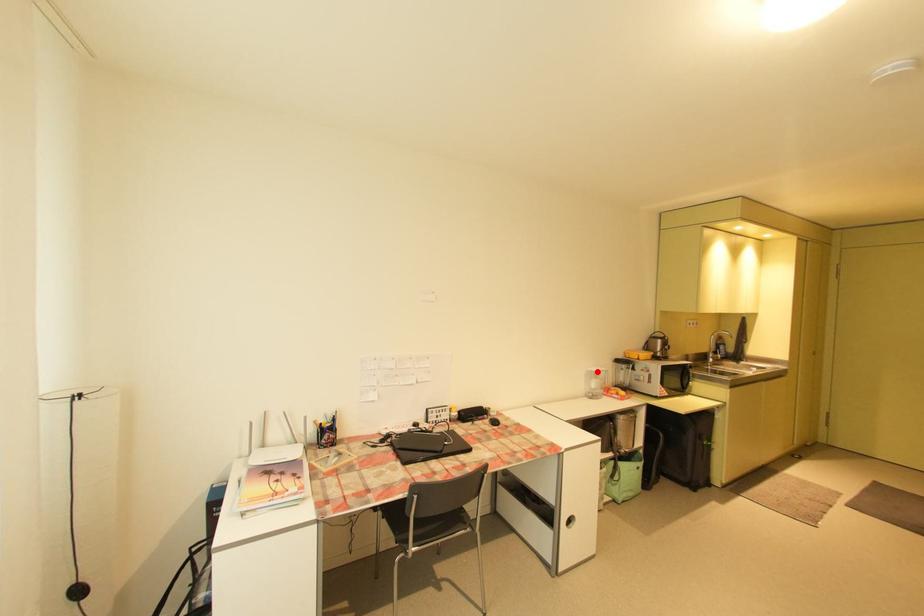
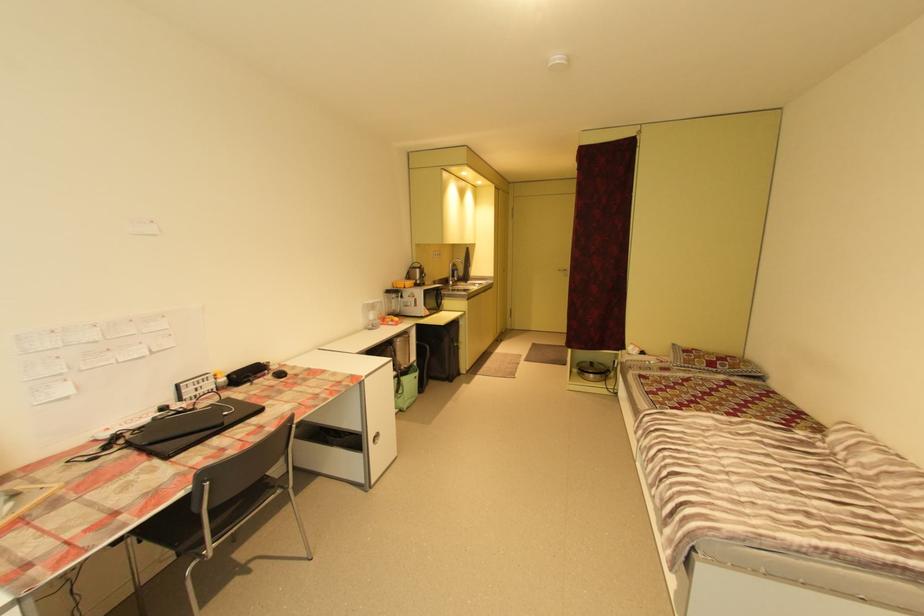
Where in the second image is the point corresponding to the highlighted location from the first image?

(374, 304)